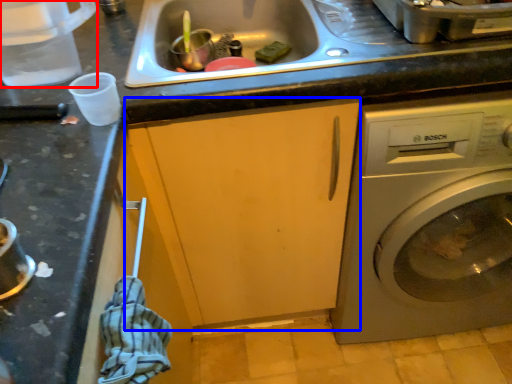
Question: Which of the following is the closest to the observer, appliance (highlighted by a red box) or cabinetry (highlighted by a blue box)?

Choices:
 (A) appliance
 (B) cabinetry

Answer: (A)